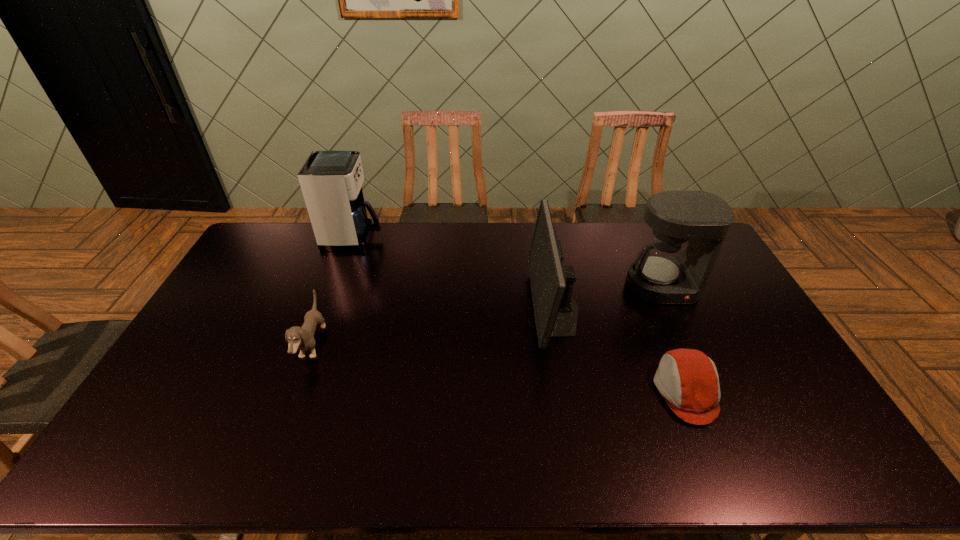
This screenshot has width=960, height=540. Find the location of `the left coffee maker`. the left coffee maker is located at coordinates (331, 182).

Where is `the farthest object`? the farthest object is located at coordinates (331, 182).

Locate an element on the screen. Image resolution: width=960 pixels, height=540 pixels. the nearer coffee maker is located at coordinates (665, 274).

At what (x,y) coordinates should I click in order to perform the action: click on the third object from right to left. Please return your answer as a coordinate pair (x, y). Looking at the image, I should click on (556, 312).

The width and height of the screenshot is (960, 540). Find the location of `puppy`. puppy is located at coordinates (302, 338).

This screenshot has height=540, width=960. Identify the location of cap. (688, 379).

Where is `vacant region located 0.350m on the front panel of the farthest object`? The height and width of the screenshot is (540, 960). vacant region located 0.350m on the front panel of the farthest object is located at coordinates (470, 237).

The height and width of the screenshot is (540, 960). Identify the location of vacant region located 0.130m on the button side of the nearer coffee maker. (684, 336).

Locate an element on the screen. free space located on the screen side of the computer monitor is located at coordinates pyautogui.click(x=419, y=308).

This screenshot has width=960, height=540. In order to click on free location located 0.270m on the screen side of the computer monitor in this screenshot , I will do `click(449, 308)`.